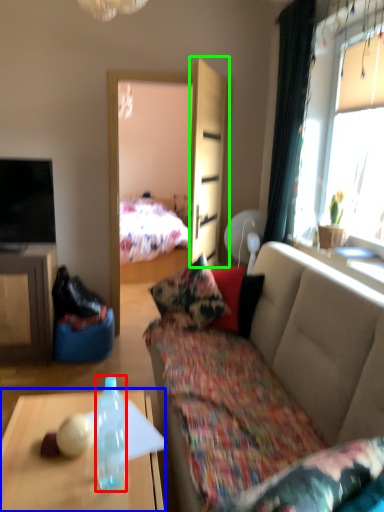
Question: Based on their relative distances, which object is nearer to bottle (highlighted by a red box)? Choose from desk (highlighted by a blue box) and armoire (highlighted by a green box).

Choices:
 (A) desk
 (B) armoire

Answer: (A)